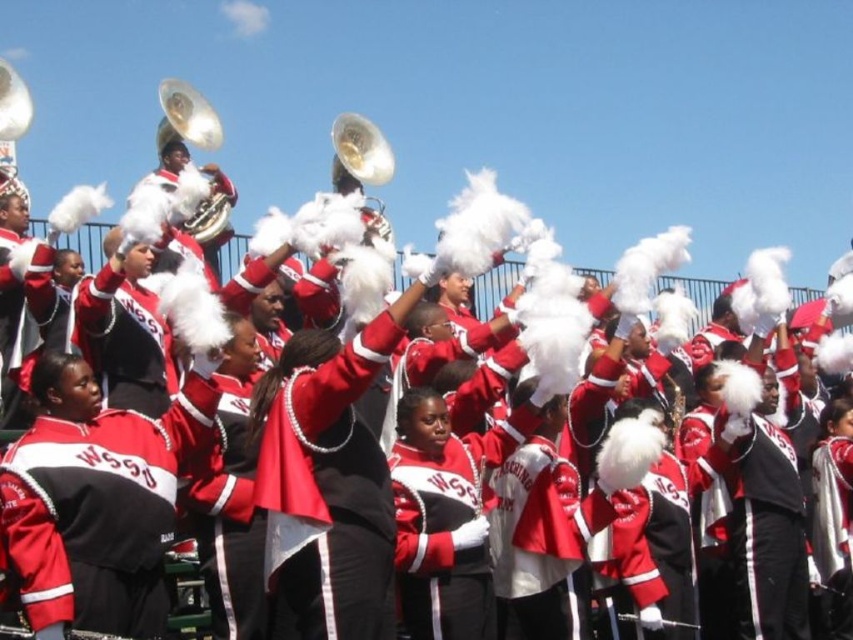
Question: Does matte red jacket at center appear on the right side of shiny brass tuba at upper left?

Choices:
 (A) yes
 (B) no

Answer: (A)

Question: Which object is farther from the camera taking this photo?

Choices:
 (A) matte red jacket at center
 (B) red matte jacket at center
 (C) shiny brass tuba at upper left

Answer: (C)

Question: Can you confirm if red matte jacket at center is positioned to the left of shiny brass tuba at upper left?

Choices:
 (A) yes
 (B) no

Answer: (B)

Question: Among these objects, which one is farthest from the camera?

Choices:
 (A) red matte jacket at center
 (B) shiny brass tuba at upper left

Answer: (B)

Question: Which object is farther from the camera taking this photo?

Choices:
 (A) red matte jacket at center
 (B) shiny brass tuba at upper left
 (C) matte red jacket at center

Answer: (B)

Question: Does red matte jacket at center appear under shiny brass tuba at upper left?

Choices:
 (A) yes
 (B) no

Answer: (A)